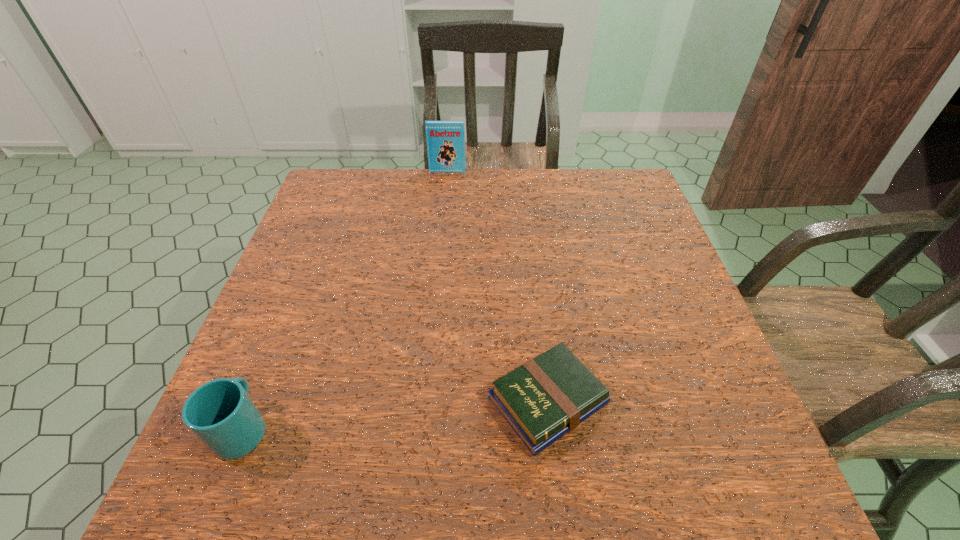
Identify the location of vacant point located 0.140m on the right of the nearer book. (682, 401).

Locate an element on the screen. The height and width of the screenshot is (540, 960). object at the far edge is located at coordinates (445, 140).

Image resolution: width=960 pixels, height=540 pixels. I want to click on cup that is at the near edge, so click(x=221, y=414).

Where is `book at the near edge`? Image resolution: width=960 pixels, height=540 pixels. book at the near edge is located at coordinates (547, 397).

The height and width of the screenshot is (540, 960). Find the location of `object positioned at the left edge`. object positioned at the left edge is located at coordinates (221, 414).

At what (x,y) coordinates should I click in order to perform the action: click on object that is positioned at the near left corner. Please return your answer as a coordinate pair (x, y). Looking at the image, I should click on (221, 414).

Where is `free region at the far edge of the desktop`? The image size is (960, 540). free region at the far edge of the desktop is located at coordinates (434, 187).

This screenshot has height=540, width=960. Identify the location of vacant space at the near edge. (426, 490).

In the image, there is a desktop. Where is `vacant region at the left edge`? This screenshot has height=540, width=960. vacant region at the left edge is located at coordinates (299, 390).

This screenshot has height=540, width=960. In the image, there is a desktop. Identify the location of vacant area at the right edge. (665, 386).